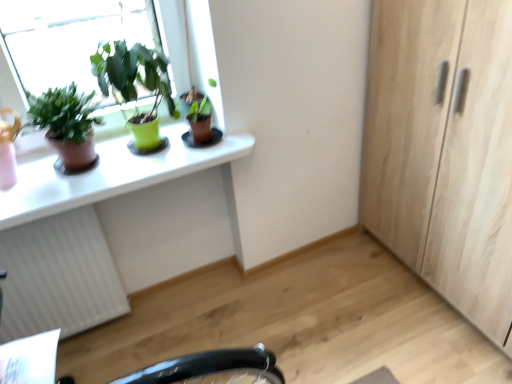
Locate an element on the screen. The width and height of the screenshot is (512, 384). vacant region under white textured radiator at lower left (from a real-world perspective) is located at coordinates coord(92,331).